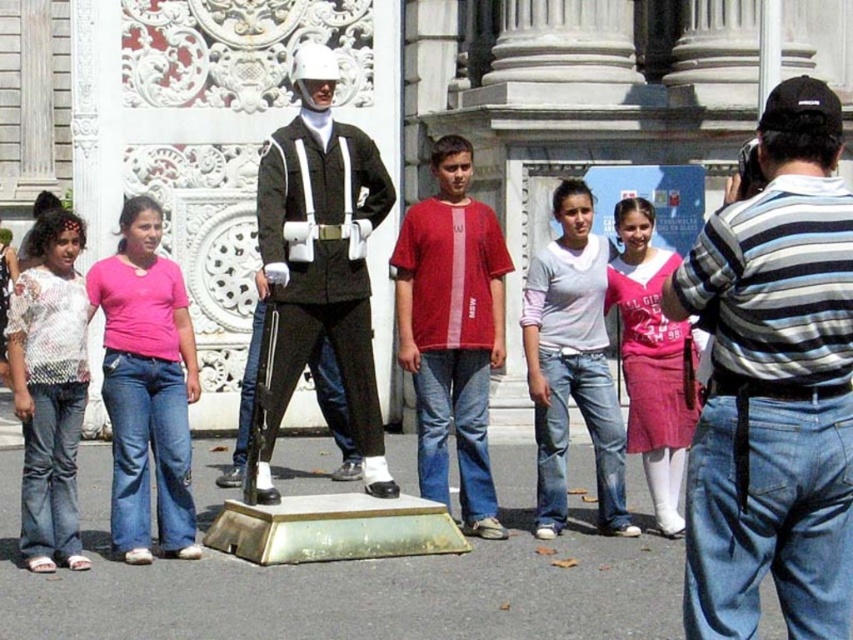
Who is more forward, (764, 381) or (543, 289)?

Positioned in front is point (764, 381).

Is striped cotton shirt at right below matte black uniform at center?

Correct, striped cotton shirt at right is located below matte black uniform at center.

Find the location of a particular element. The height and width of the screenshot is (640, 853). striped cotton shirt at right is located at coordinates (775, 385).

Looking at this image, can you confirm if pink fabric shirt at left is shorter than white lace shirt at left?

Correct, pink fabric shirt at left is not as tall as white lace shirt at left.

Which is above, pink fabric shirt at left or white lace shirt at left?

white lace shirt at left

The image size is (853, 640). What are the coordinates of `pink fabric shirt at left` in the screenshot? It's located at (144, 397).

Is red matte t-shirt at center taller than matte black uniform at center?

Yes.

Who is more distant from viewer, (401, 278) or (579, 406)?

Point (401, 278)

Does point (451, 413) come farther from viewer compared to point (567, 433)?

Yes, point (451, 413) is farther from viewer.

You are a GUI agent. You are given a task and a screenshot of the screen. Output one action in this format:
    pyautogui.click(x=<x>, y=<y>)
    Task: Click on the red matte t-shirt at center
    This screenshot has height=640, width=853.
    Given the screenshot: What is the action you would take?
    pyautogui.click(x=450, y=339)